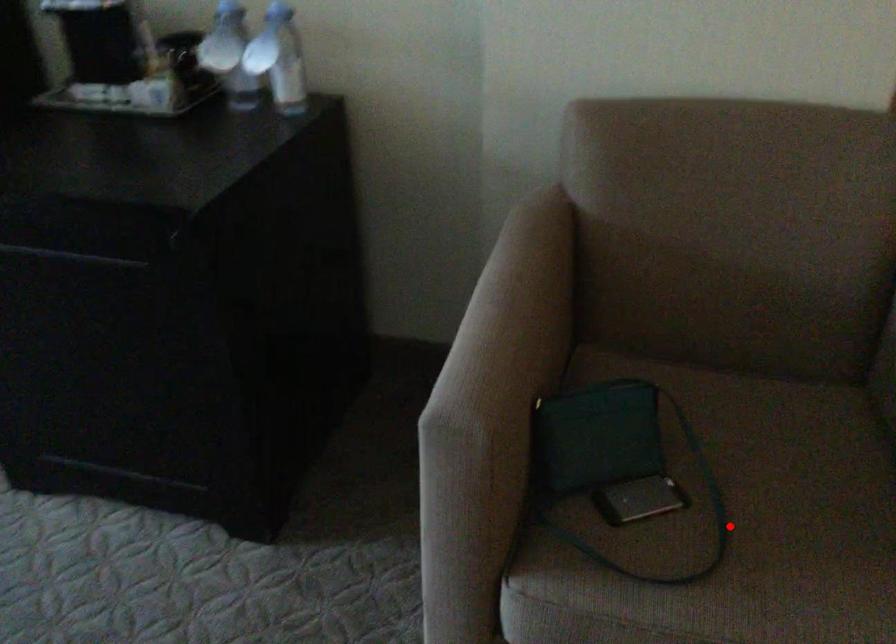
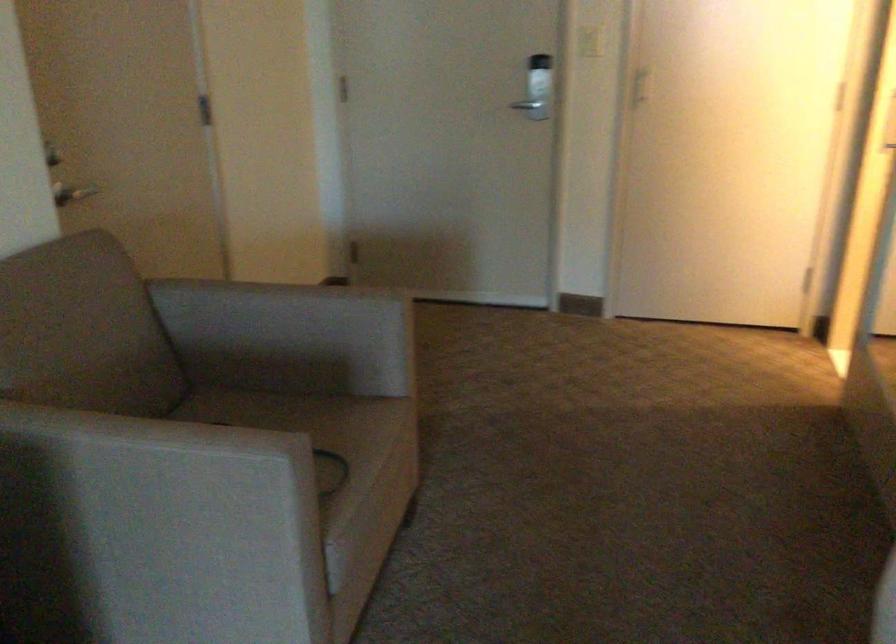
Question: I am providing you with two images of the same scene from different viewpoints. A red point is marked on the first image. Is the red point's position out of view in image 2?

Choices:
 (A) Yes
 (B) No

Answer: (A)